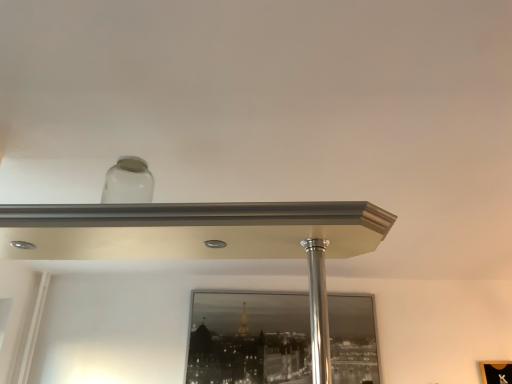
Locate an element on the screen. This screenshot has height=384, width=512. polished silver pole at center is located at coordinates (318, 310).

The height and width of the screenshot is (384, 512). Describe the element at coordinates (318, 310) in the screenshot. I see `polished silver pole at center` at that location.

Find the location of a particular element. The image size is (512, 384). black glass mirror at center is located at coordinates (249, 338).

Describe the element at coordinates (249, 338) in the screenshot. I see `black glass mirror at center` at that location.

I want to click on polished silver pole at center, so (x=318, y=310).

Visually, is black glass mirror at center positioned to the left or to the right of polished silver pole at center?

black glass mirror at center is positioned on polished silver pole at center's left side.

Which object is closer to the camera, black glass mirror at center or polished silver pole at center?

polished silver pole at center is in front.

Which is nearer, (359, 308) or (310, 299)?

Point (359, 308) is farther from the camera than point (310, 299).

From the picture: From the image's perspective, which object appears higher, black glass mirror at center or polished silver pole at center?

From the image's view, polished silver pole at center is above.

From a real-world perspective, between black glass mirror at center and polished silver pole at center, who is vertically lower?

polished silver pole at center is physically lower.

Which of these two, black glass mirror at center or polished silver pole at center, is thinner?

With smaller width is polished silver pole at center.

Considering the relative sizes of black glass mirror at center and polished silver pole at center in the image provided, is black glass mirror at center shorter than polished silver pole at center?

No, black glass mirror at center is not shorter than polished silver pole at center.

Can you confirm if black glass mirror at center is bigger than polished silver pole at center?

Indeed, black glass mirror at center has a larger size compared to polished silver pole at center.

Is black glass mirror at center situated inside polished silver pole at center or outside?

The correct answer is: outside.

Is black glass mirror at center positioned far away from polished silver pole at center?

Absolutely, black glass mirror at center is distant from polished silver pole at center.

Is black glass mirror at center facing away from polished silver pole at center?

No, polished silver pole at center is not at the back of black glass mirror at center.

Can you tell me how much black glass mirror at center and polished silver pole at center differ in facing direction?

The angular difference between black glass mirror at center and polished silver pole at center is 88.7 degrees.

Where is `mirror below the polished silver pole at center (from the image's perspective)`? Image resolution: width=512 pixels, height=384 pixels. mirror below the polished silver pole at center (from the image's perspective) is located at coordinates (249, 338).

Considering the positions of objects polished silver pole at center and black glass mirror at center in the image provided, who is more to the right, polished silver pole at center or black glass mirror at center?

polished silver pole at center is more to the right.

Is the position of polished silver pole at center more distant than that of black glass mirror at center?

No, it is not.

Is point (322, 270) less distant than point (209, 326)?

Yes, point (322, 270) is closer to viewer.

From the image's perspective, would you say polished silver pole at center is positioned over black glass mirror at center?

Yes.

From a real-world perspective, is polished silver pole at center above or below black glass mirror at center?

From a real-world perspective, polished silver pole at center is physically below black glass mirror at center.

Looking at their sizes, would you say polished silver pole at center is wider or thinner than black glass mirror at center?

Considering their sizes, polished silver pole at center looks slimmer than black glass mirror at center.

Considering the relative sizes of polished silver pole at center and black glass mirror at center in the image provided, is polished silver pole at center shorter than black glass mirror at center?

Indeed, polished silver pole at center has a lesser height compared to black glass mirror at center.

Can you confirm if polished silver pole at center is bigger than black glass mirror at center?

Actually, polished silver pole at center might be smaller than black glass mirror at center.

Would you say polished silver pole at center contains black glass mirror at center?

No, black glass mirror at center is located outside of polished silver pole at center.

Looking at this image, is polished silver pole at center next to black glass mirror at center?

No, polished silver pole at center is not making contact with black glass mirror at center.

Could you tell me if polished silver pole at center is turned towards black glass mirror at center?

No, polished silver pole at center does not turn towards black glass mirror at center.

This screenshot has height=384, width=512. Identify the location of pillar that is on the right side of black glass mirror at center. (318, 310).

Find the location of a particular element. mirror behind the polished silver pole at center is located at coordinates (249, 338).

I want to click on pillar lying above the black glass mirror at center (from the image's perspective), so click(318, 310).